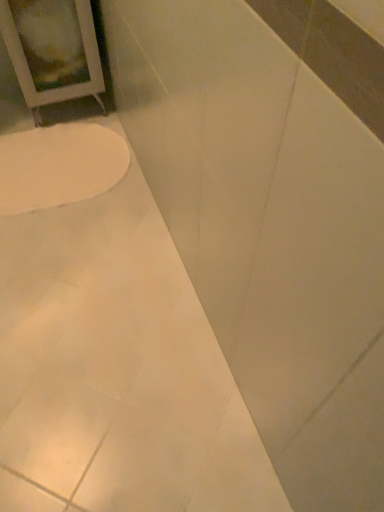
Question: Looking at the image, does white glossy toilet at lower left seem bigger or smaller compared to white glossy bathtub at lower left?

Choices:
 (A) big
 (B) small

Answer: (B)

Question: From their relative heights in the image, would you say white glossy toilet at lower left is taller or shorter than white glossy bathtub at lower left?

Choices:
 (A) tall
 (B) short

Answer: (B)

Question: Do you think white glossy toilet at lower left is within white glossy bathtub at lower left, or outside of it?

Choices:
 (A) outside
 (B) inside

Answer: (B)

Question: From the image's perspective, relative to white glossy toilet at lower left, is white glossy bathtub at lower left above or below?

Choices:
 (A) below
 (B) above

Answer: (A)

Question: Considering the positions of white glossy bathtub at lower left and white glossy toilet at lower left in the image, is white glossy bathtub at lower left wider or thinner than white glossy toilet at lower left?

Choices:
 (A) thin
 (B) wide

Answer: (B)

Question: In terms of size, does white glossy bathtub at lower left appear bigger or smaller than white glossy toilet at lower left?

Choices:
 (A) big
 (B) small

Answer: (A)

Question: Would you say white glossy bathtub at lower left is inside or outside white glossy toilet at lower left?

Choices:
 (A) inside
 (B) outside

Answer: (B)